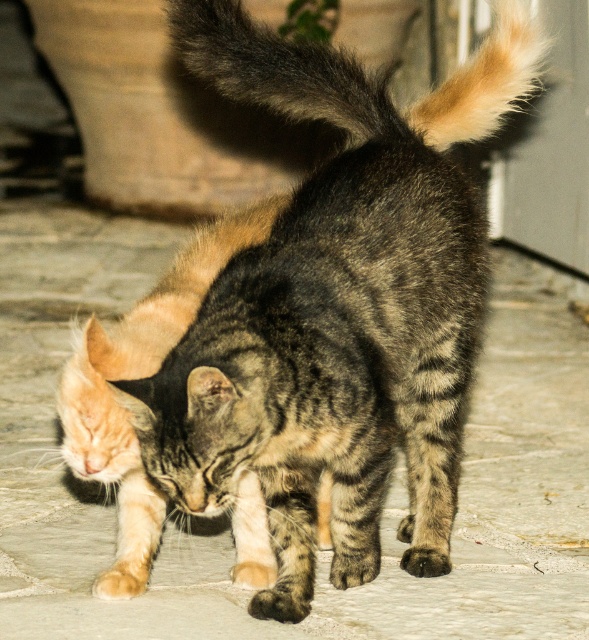
Can you confirm if fluffy brown tail at upper right is wider than light brown fur paw at lower left?

Yes.

Which is in front, point (431, 92) or point (107, 593)?

Point (107, 593)

The width and height of the screenshot is (589, 640). Identify the location of fluffy brown tail at upper right. (484, 81).

In the scene shown: Who is positioned more to the left, dark brown fur paw at lower center or brown fur paw at lower center?

dark brown fur paw at lower center

Does dark brown fur paw at lower center have a greater height compared to brown fur paw at lower center?

Yes, dark brown fur paw at lower center is taller than brown fur paw at lower center.

Measure the distance between point (289, 593) and camera.

Point (289, 593) is 2.09 meters from camera.

The width and height of the screenshot is (589, 640). Find the location of `dark brown fur paw at lower center`. dark brown fur paw at lower center is located at coordinates (282, 600).

Does light brown fur paw at lower left have a larger size compared to light orange fur at lower left?

Correct, light brown fur paw at lower left is larger in size than light orange fur at lower left.

Does light brown fur paw at lower left have a greater height compared to light orange fur at lower left?

Indeed, light brown fur paw at lower left has a greater height compared to light orange fur at lower left.

Is point (125, 577) positioned in front of point (241, 564)?

Yes, point (125, 577) is closer to viewer.

The width and height of the screenshot is (589, 640). Identify the location of light brown fur paw at lower left. (123, 579).